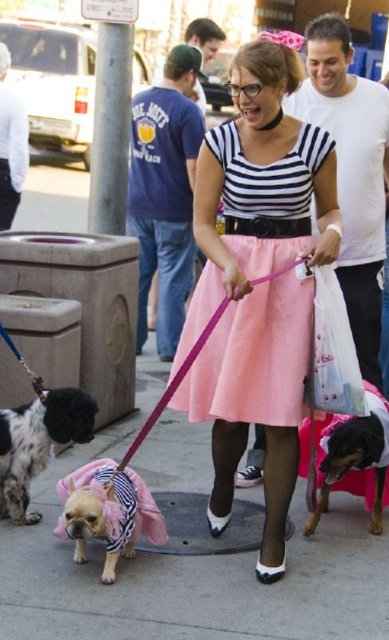
Question: Which object is farther from the camera taking this photo?

Choices:
 (A) spotted fur dog at lower left
 (B) black and tan dog at center
 (C) pink satin skirt at center
 (D) pink fabric dog at center

Answer: (B)

Question: Which of the following is the farthest from the observer?

Choices:
 (A) black and tan dog at center
 (B) pink fabric dog at center
 (C) spotted fur dog at lower left

Answer: (A)

Question: Can you confirm if pink satin skirt at center is bigger than pink fabric dog at center?

Choices:
 (A) yes
 (B) no

Answer: (A)

Question: Which object is farther from the camera taking this photo?

Choices:
 (A) pink fabric dog at center
 (B) spotted fur dog at lower left
 (C) pink satin skirt at center
 (D) black and tan dog at center

Answer: (D)

Question: Where is pink satin skirt at center located in relation to spotted fur dog at lower left in the image?

Choices:
 (A) left
 (B) right

Answer: (B)

Question: Can you confirm if black and tan dog at center is smaller than translucent plastic bag at center?

Choices:
 (A) no
 (B) yes

Answer: (A)